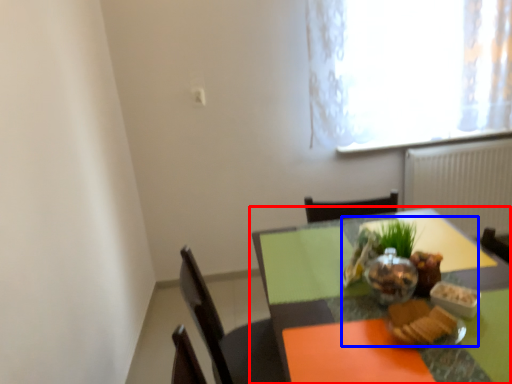
Question: Which object appears farthest to the camera in this image, table (highlighted by a red box) or meal (highlighted by a blue box)?

Choices:
 (A) table
 (B) meal

Answer: (B)